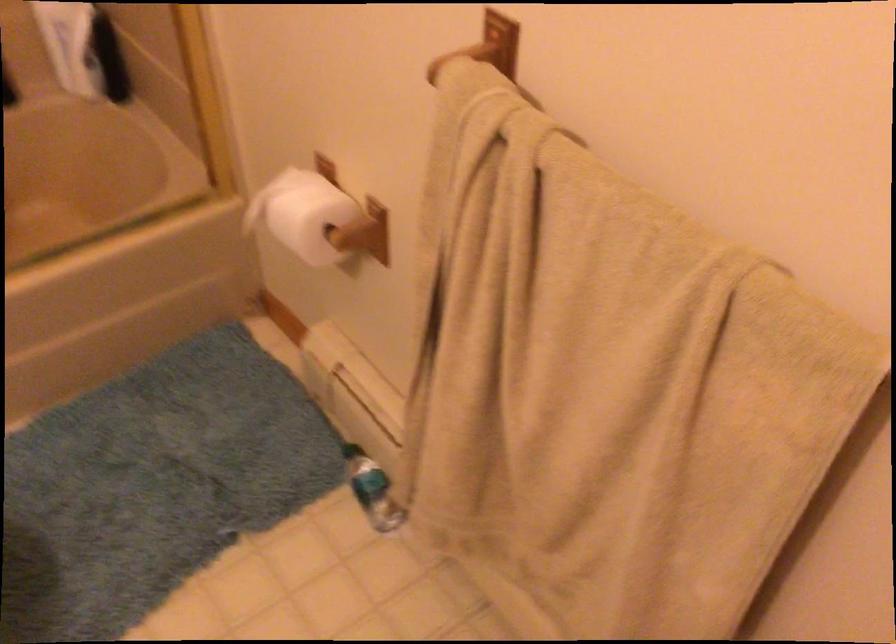
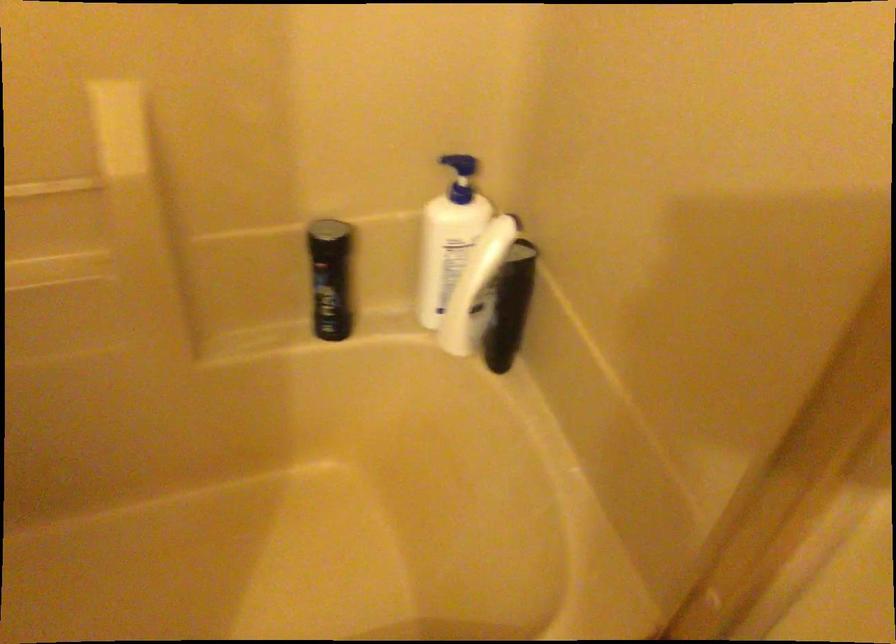
The images are taken continuously from a first-person perspective. In which direction are you moving?

The cameraman moved toward left, forward.